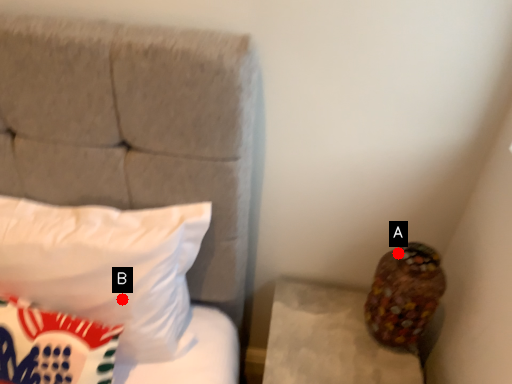
Question: Two points are circled on the image, labeled by A and B beside each circle. Which point appears closest to the camera in this image?

Choices:
 (A) A is closer
 (B) B is closer

Answer: (B)